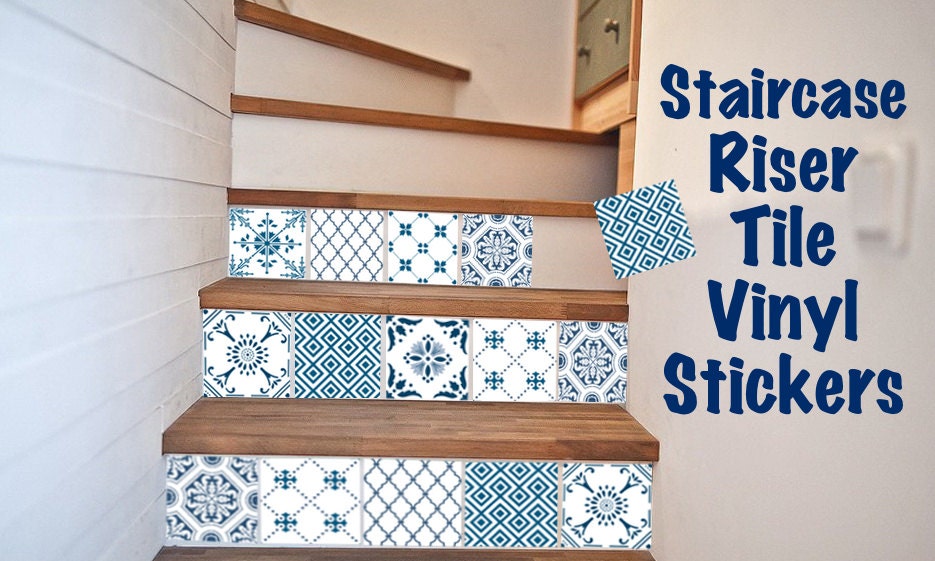
Where is `drawer`? The image size is (935, 561). drawer is located at coordinates (609, 59).